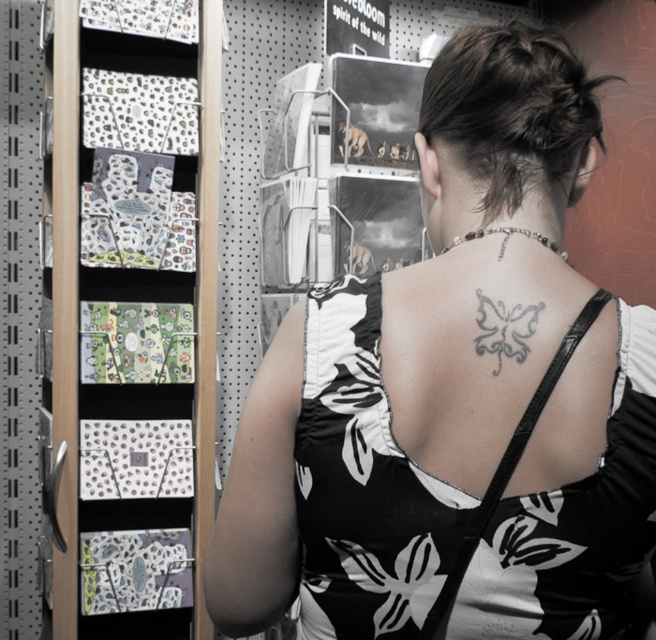
You are a photographer trying to capture the black and white dress at center in a closeup shot. Your camera has a minimum focusing distance of 80 centimeters. Will you be able to take the photo without moving closer?

The black and white dress at center is 78.56 centimeters away from camera, which is within the camera minimum focusing distance of 80 centimeters. Therefore, you can take the photo without moving closer.

You are standing in a store and want to reach the point marked as point (256, 580). Your arm can extend 30 inches. Can you reach that point without moving your feet?

The distance between you and point (256, 580) is 34.70 inches, which is longer than your arm extension of 30 inches. Therefore, you cannot reach the point without moving your feet.